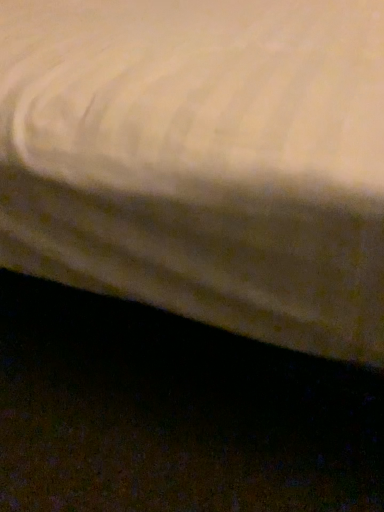
Locate an element on the screen. This screenshot has width=384, height=512. white textured mattress at center is located at coordinates (202, 160).

The width and height of the screenshot is (384, 512). What do you see at coordinates (202, 160) in the screenshot?
I see `white textured mattress at center` at bounding box center [202, 160].

Locate an element on the screen. This screenshot has width=384, height=512. white textured mattress at center is located at coordinates (202, 160).